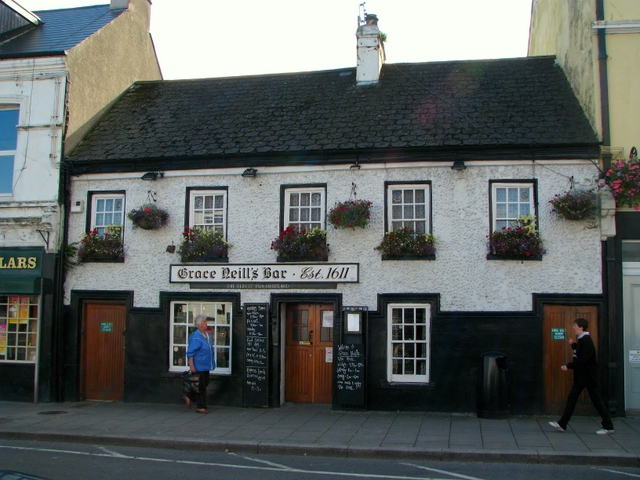
In order to click on sign that says "grace neil's bar" in this screenshot , I will do `click(264, 280)`, `click(240, 278)`.